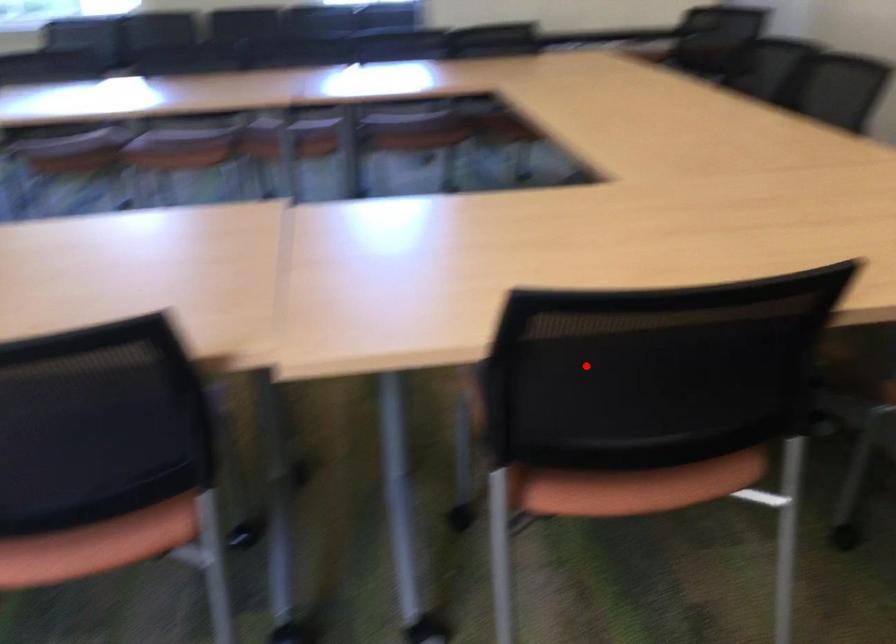
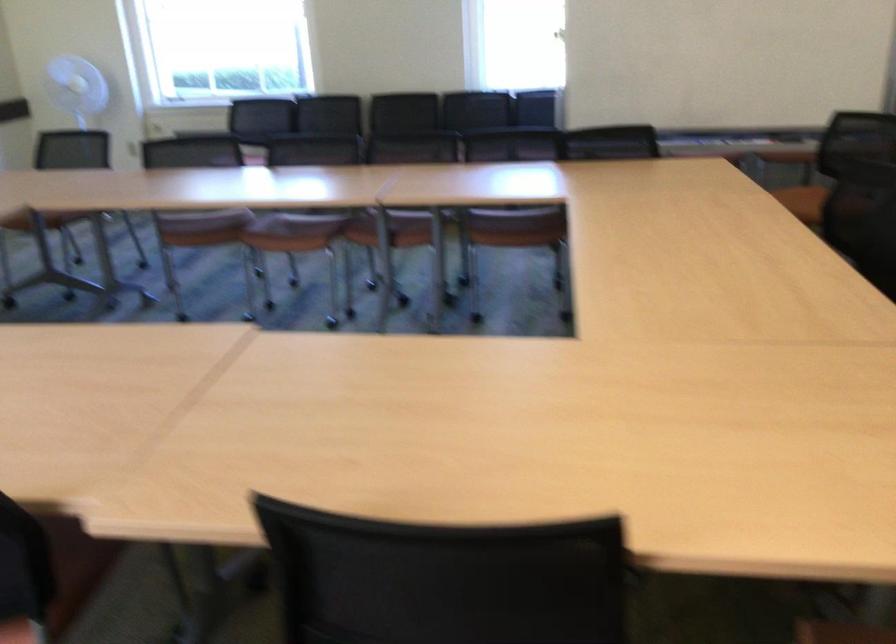
Question: I am providing you with two images of the same scene from different viewpoints. A red point is marked on the first image. Is the red point's position out of view in image 2?

Choices:
 (A) Yes
 (B) No

Answer: (B)